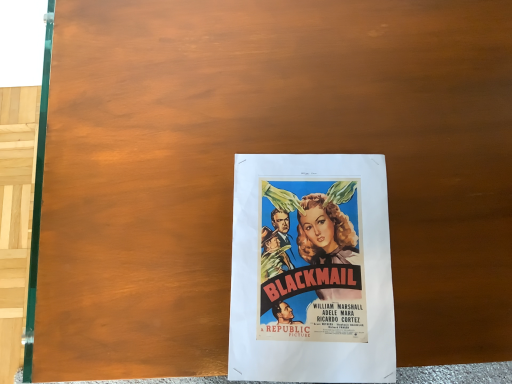
Locate an element on the screen. free space to the back side of white paper poster at center is located at coordinates (311, 92).